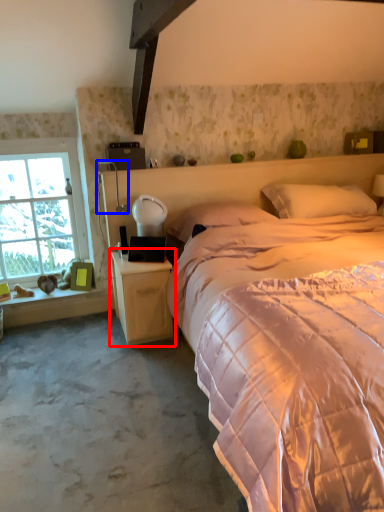
Question: Which of the following is the closest to the observer, nightstand (highlighted by a red box) or table lamp (highlighted by a blue box)?

Choices:
 (A) nightstand
 (B) table lamp

Answer: (A)